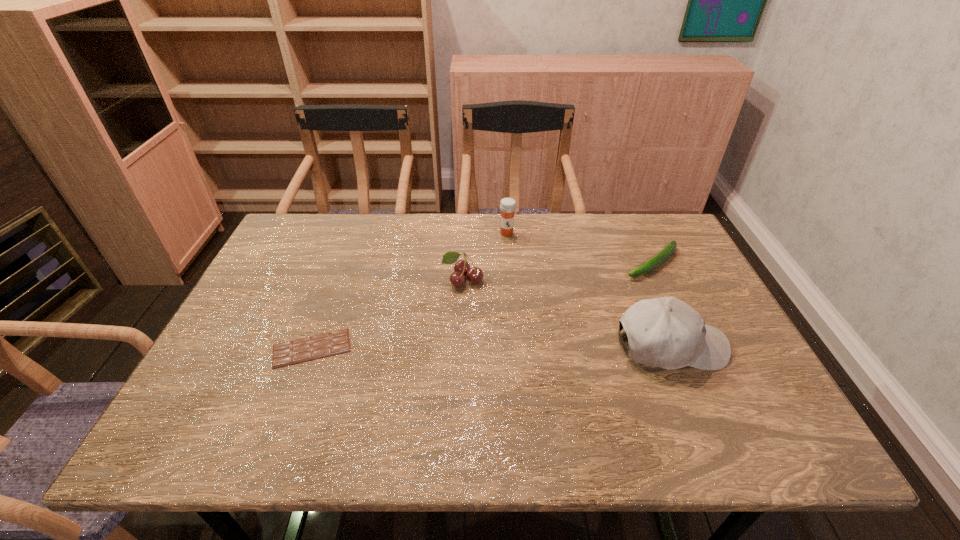
Identify the location of chocolate bar. (305, 349).

I want to click on the leftmost object, so click(x=305, y=349).

This screenshot has width=960, height=540. In order to click on baseball cap in this screenshot , I will do `click(665, 332)`.

Locate an element on the screen. This screenshot has width=960, height=540. the third object from right to left is located at coordinates (508, 205).

Locate an element on the screen. This screenshot has height=540, width=960. the farthest object is located at coordinates (508, 205).

I want to click on the fourth object from right to left, so click(x=462, y=268).

You are a GUI agent. You are given a task and a screenshot of the screen. Output one action in this format:
    pyautogui.click(x=<x>, y=<y>)
    Task: Click on the cherry
    
    Given the screenshot: What is the action you would take?
    (462, 268)

The image size is (960, 540). I want to click on the fourth tallest object, so [667, 251].

This screenshot has width=960, height=540. I want to click on vacant space located 0.050m on the left of the chocolate bar, so click(251, 348).

Where is `free space located on the label side of the third object from right to left`? The width and height of the screenshot is (960, 540). free space located on the label side of the third object from right to left is located at coordinates (509, 284).